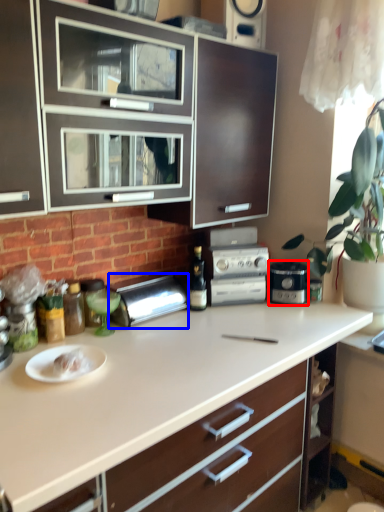
Question: Which of the following is the closest to the observer, home appliance (highlighted by a red box) or appliance (highlighted by a blue box)?

Choices:
 (A) home appliance
 (B) appliance

Answer: (B)